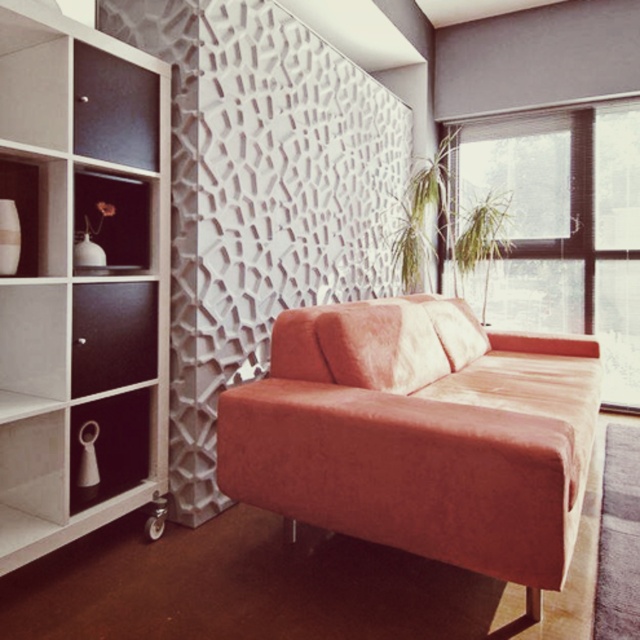
Based on the photo, does white glossy bookshelf at left appear under velvet orange couch at center?

No, white glossy bookshelf at left is not below velvet orange couch at center.

Can you confirm if white glossy bookshelf at left is smaller than velvet orange couch at center?

Yes.

The height and width of the screenshot is (640, 640). What do you see at coordinates (81, 282) in the screenshot?
I see `white glossy bookshelf at left` at bounding box center [81, 282].

Where is `white glossy bookshelf at left`? The height and width of the screenshot is (640, 640). white glossy bookshelf at left is located at coordinates (81, 282).

Looking at this image, between velvet orange couch at center and white glossy vase at left, which one has less height?

white glossy vase at left

Is point (461, 385) behind point (106, 481)?

Yes, point (461, 385) is farther from viewer.

Locate an element on the screen. The height and width of the screenshot is (640, 640). velvet orange couch at center is located at coordinates (419, 435).

Is velvet orange couch at center bigger than transparent glass window at upper right?

Yes.

Can you confirm if velvet orange couch at center is positioned to the right of transparent glass window at upper right?

In fact, velvet orange couch at center is to the left of transparent glass window at upper right.

Describe the element at coordinates (419, 435) in the screenshot. The image size is (640, 640). I see `velvet orange couch at center` at that location.

Find the location of a particular element. velvet orange couch at center is located at coordinates (419, 435).